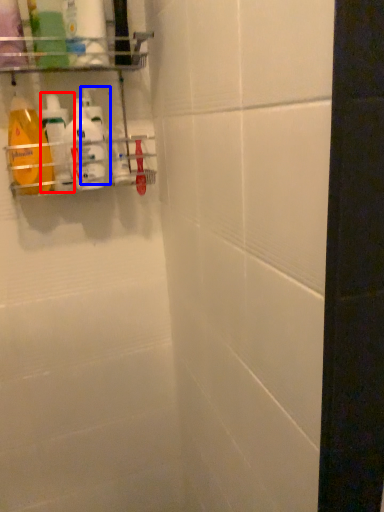
Question: Which object appears farthest to the camera in this image, cleaning product (highlighted by a red box) or cleaning product (highlighted by a blue box)?

Choices:
 (A) cleaning product
 (B) cleaning product

Answer: (B)